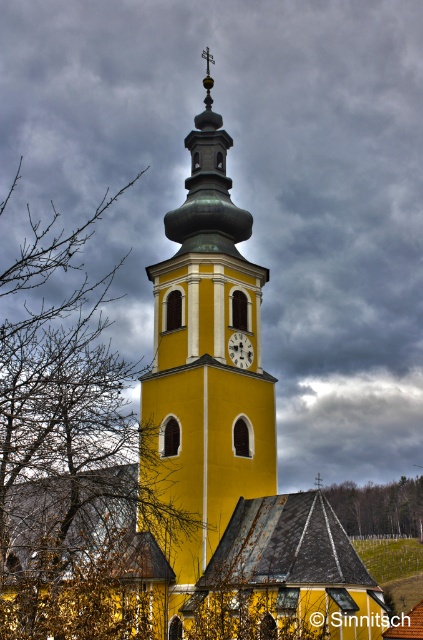
Which is above, yellow matte clock tower at center or matte yellow clock at center?

yellow matte clock tower at center is higher up.

Between yellow matte clock tower at center and matte yellow clock at center, which one appears on the right side from the viewer's perspective?

matte yellow clock at center is more to the right.

Which is in front, point (200, 404) or point (241, 336)?

Point (200, 404) is in front.

I want to click on yellow matte clock tower at center, so click(208, 353).

Which of these two, bare branches at left or yellow matte clock tower at center, stands shorter?

Standing shorter between the two is yellow matte clock tower at center.

From the picture: Does bare branches at left come in front of yellow matte clock tower at center?

Yes, it is.

Where is `bare branches at left`? This screenshot has height=640, width=423. bare branches at left is located at coordinates (77, 486).

The image size is (423, 640). Identify the location of bare branches at left. pyautogui.click(x=77, y=486).

Can you confirm if bare branches at left is bigger than green leafy tree at center?

Correct, bare branches at left is larger in size than green leafy tree at center.

What do you see at coordinates (77, 486) in the screenshot? I see `bare branches at left` at bounding box center [77, 486].

Where is `bare branches at left`? bare branches at left is located at coordinates click(x=77, y=486).